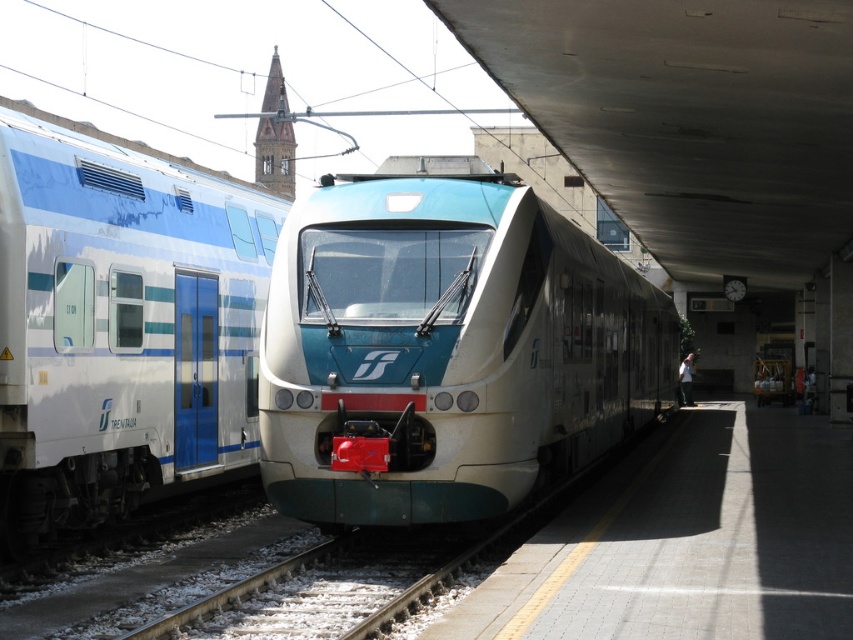
You are a passenger at the train station and want to board the matte white train at center. The white gravel at lower center is blocking your path. Can you walk around it?

The matte white train at center is larger in size than white gravel at lower center, so you can walk around the white gravel at lower center to reach the matte white train at center.

You are standing at the train station and want to reach a specific point marked at coordinates point (567, 284). If you can walk 40 feet in a minute, how long will it take you to reach that point?

The distance of point (567, 284) from viewer is 38.72 feet. Since you can walk 40 feet in a minute, it will take approximately 0.97 minutes or about 58 seconds to reach the point.